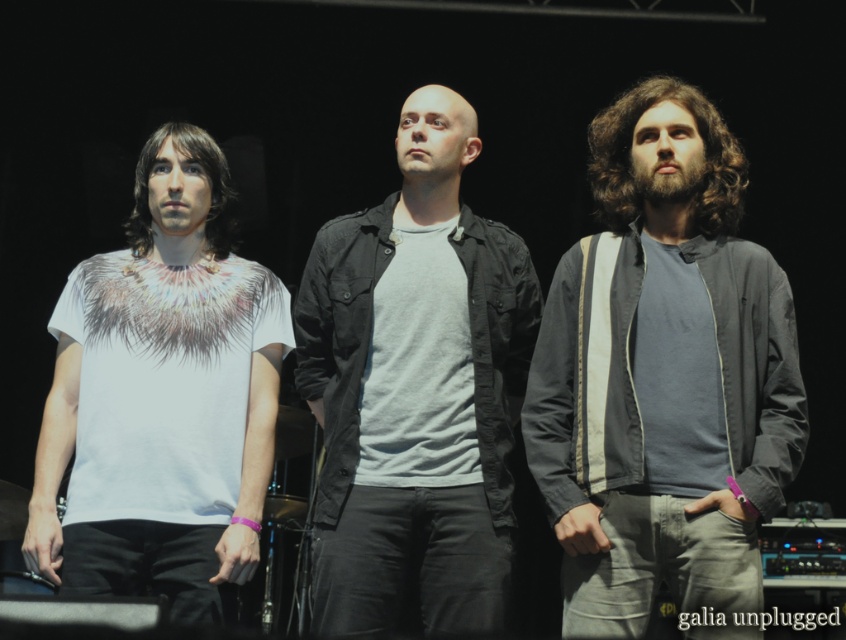
Which is more to the right, matte black jacket at center or white printed t-shirt at left?

matte black jacket at center

Who is higher up, matte black jacket at center or white printed t-shirt at left?

Positioned higher is matte black jacket at center.

The width and height of the screenshot is (846, 640). In order to click on matte black jacket at center in this screenshot , I will do `click(416, 390)`.

Is point (786, 472) positioned behind point (426, 483)?

No, (786, 472) is closer to viewer.

Between point (695, 170) and point (476, 292), which one is positioned in front?

Point (695, 170) is in front.

Image resolution: width=846 pixels, height=640 pixels. Identify the location of gray fabric jacket at right. (663, 378).

Which is more to the left, gray fabric jacket at right or white printed t-shirt at left?

white printed t-shirt at left is more to the left.

Is point (652, 397) more distant than point (176, 394)?

No, (652, 397) is in front of (176, 394).

This screenshot has width=846, height=640. I want to click on gray fabric jacket at right, so click(663, 378).